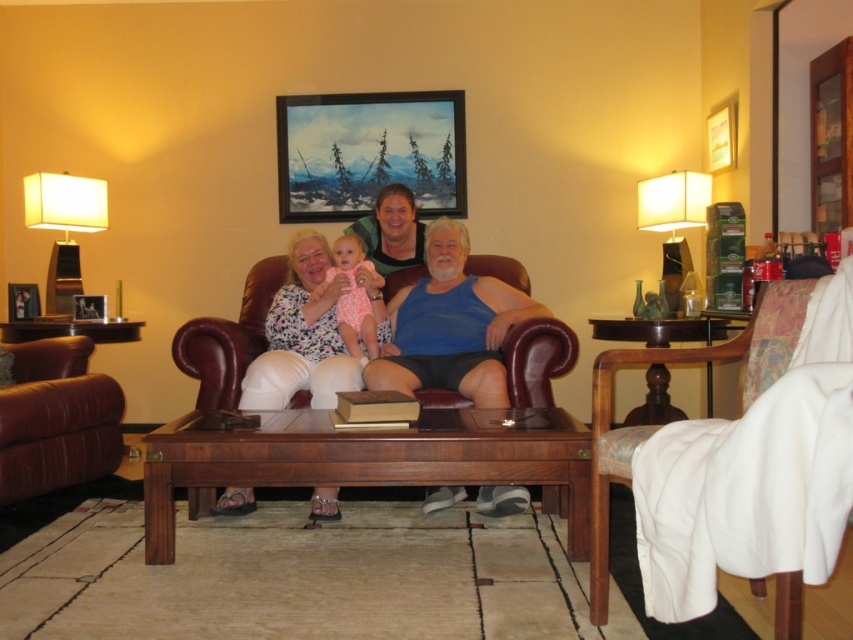
Between painted wood picture frame at upper center and leather armchair at left, which one has more height?

painted wood picture frame at upper center

Looking at this image, who is more forward, [291,99] or [48,461]?

Point [48,461] is in front.

The height and width of the screenshot is (640, 853). Find the location of `painted wood picture frame at upper center`. painted wood picture frame at upper center is located at coordinates (369, 152).

Does leather armchair at left have a larger size compared to brushed metal picture frame at upper left?

Yes, leather armchair at left is bigger than brushed metal picture frame at upper left.

Is leather armchair at left smaller than brushed metal picture frame at upper left?

Actually, leather armchair at left might be larger than brushed metal picture frame at upper left.

This screenshot has width=853, height=640. Identify the location of leather armchair at left. (56, 419).

Find the location of a particular element. leather armchair at left is located at coordinates (56, 419).

Is point (321, 180) closer to viewer compared to point (245, 500)?

No, (321, 180) is behind (245, 500).

Does painted wood picture frame at upper center have a smaller size compared to white floral dress at center?

Yes.

This screenshot has height=640, width=853. Describe the element at coordinates (369, 152) in the screenshot. I see `painted wood picture frame at upper center` at that location.

This screenshot has width=853, height=640. In order to click on painted wood picture frame at upper center in this screenshot , I will do `click(369, 152)`.